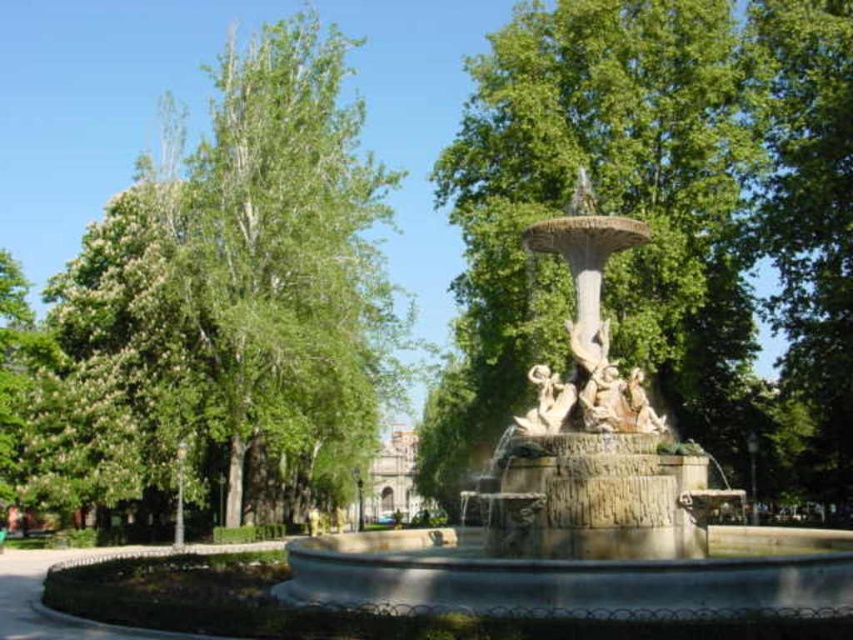
You are standing in the park and want to take a photo of the green leafy tree at center. Your camera has a maximum focus range of 100 meters. Will you be able to focus on the tree?

The green leafy tree at center is 90.49 meters from viewer, so yes, the camera can focus on the tree since it is within the 100 meters range.

You are standing at the edge of the park and want to take a photo of the stone fountain at center and the stone statue at center. Which object should you focus on first if you want to capture both in the same frame without moving your camera?

The stone fountain at center is located above the stone statue at center, so you should focus on the stone statue at center first to ensure both are in the frame.

You are planning to place a new bench in the park. The bench requires a space wider than the stone statue at center. Can the area where the stone fountain at center is located provide enough space for the bench?

The stone fountain at center is wider than the stone statue at center, so the area where the stone fountain at center is located has enough space to accommodate the bench requiring more width than the stone statue at center.